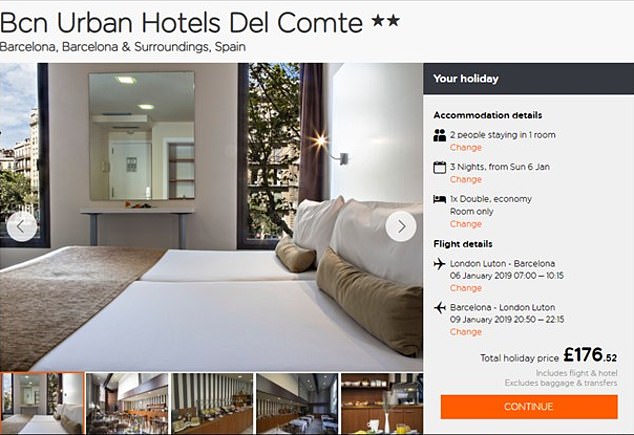
Where is `light`? Image resolution: width=634 pixels, height=435 pixels. light is located at coordinates (321, 141).